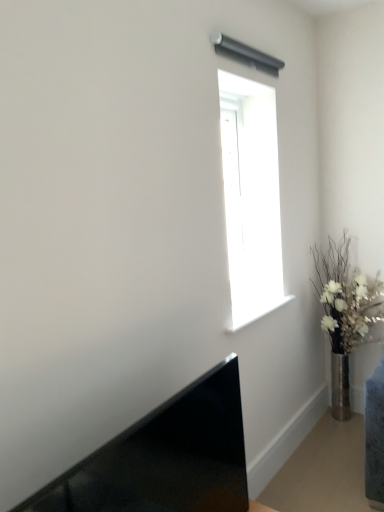
Question: Considering the relative sizes of matte black laptop at lower left and silver metallic vase at right in the image provided, is matte black laptop at lower left thinner than silver metallic vase at right?

Choices:
 (A) no
 (B) yes

Answer: (B)

Question: Does matte black laptop at lower left turn towards silver metallic vase at right?

Choices:
 (A) yes
 (B) no

Answer: (B)

Question: Does matte black laptop at lower left appear on the right side of silver metallic vase at right?

Choices:
 (A) no
 (B) yes

Answer: (A)

Question: Does matte black laptop at lower left appear on the left side of silver metallic vase at right?

Choices:
 (A) yes
 (B) no

Answer: (A)

Question: Is matte black laptop at lower left bigger than silver metallic vase at right?

Choices:
 (A) no
 (B) yes

Answer: (A)

Question: From a real-world perspective, is matte black laptop at lower left positioned under silver metallic vase at right based on gravity?

Choices:
 (A) yes
 (B) no

Answer: (B)

Question: Is transparent glass window at upper center next to silver metallic vase at right and touching it?

Choices:
 (A) yes
 (B) no

Answer: (B)

Question: Is transparent glass window at upper center surrounding silver metallic vase at right?

Choices:
 (A) yes
 (B) no

Answer: (B)

Question: Can you confirm if transparent glass window at upper center is positioned to the left of silver metallic vase at right?

Choices:
 (A) no
 (B) yes

Answer: (B)

Question: Does transparent glass window at upper center come behind silver metallic vase at right?

Choices:
 (A) yes
 (B) no

Answer: (B)

Question: Does transparent glass window at upper center have a larger size compared to silver metallic vase at right?

Choices:
 (A) yes
 (B) no

Answer: (B)

Question: Can you confirm if transparent glass window at upper center is shorter than silver metallic vase at right?

Choices:
 (A) no
 (B) yes

Answer: (B)

Question: Considering the relative sizes of silver metallic vase at right and transparent glass window at upper center in the image provided, is silver metallic vase at right smaller than transparent glass window at upper center?

Choices:
 (A) no
 (B) yes

Answer: (A)